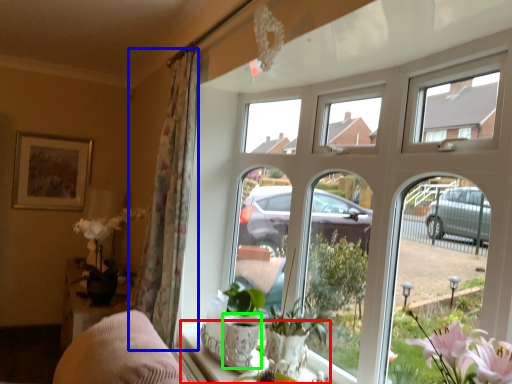
Question: Based on their relative distances, which object is nearer to window sill (highlighted by a red box)? Choose from curtain (highlighted by a blue box) and glass vase (highlighted by a green box).

Choices:
 (A) curtain
 (B) glass vase

Answer: (B)